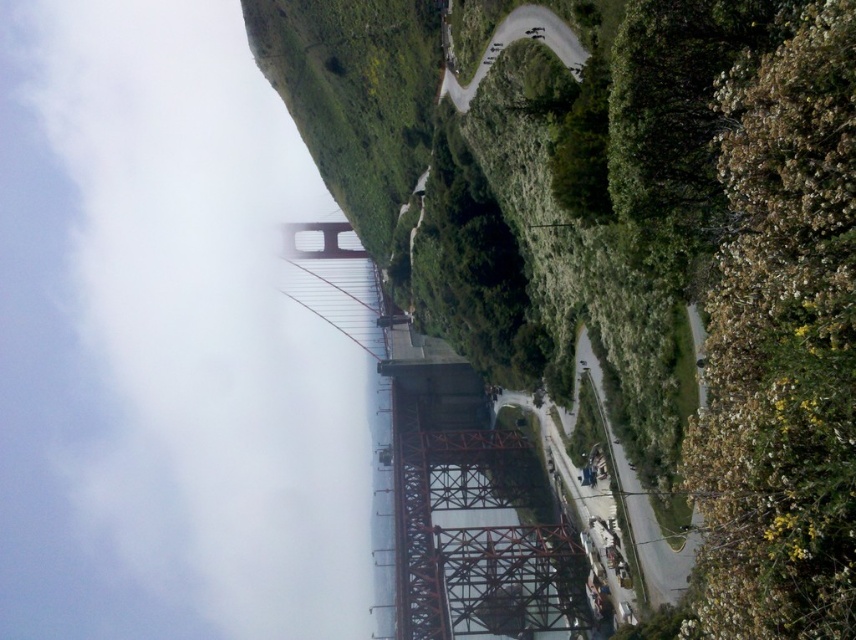
Is white fluffy cloud at upper left wider than green grassy hillside at upper center?

Correct, the width of white fluffy cloud at upper left exceeds that of green grassy hillside at upper center.

Is point (186, 170) behind point (522, 4)?

Yes, point (186, 170) is farther from viewer.

Where is `white fluffy cloud at upper left`? white fluffy cloud at upper left is located at coordinates (165, 342).

Find the location of a particular element. Image resolution: width=856 pixels, height=640 pixels. white fluffy cloud at upper left is located at coordinates (165, 342).